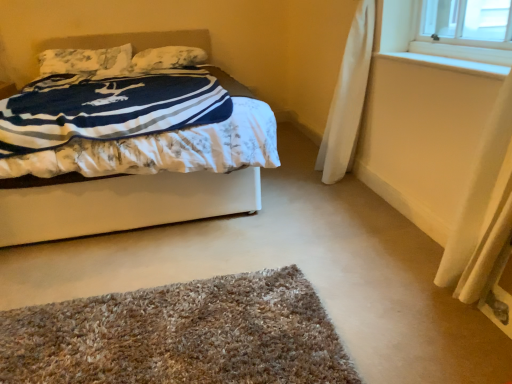
Locate an element on the screen. vacant area that lies between white fabric bed at center and brown shaggy rug at lower center is located at coordinates click(160, 267).